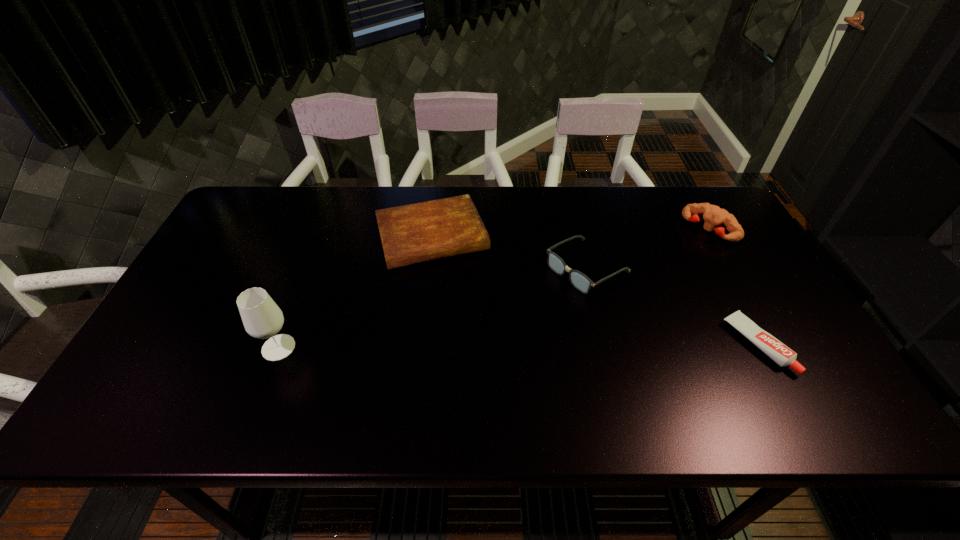
This screenshot has height=540, width=960. Identify the location of the leftmost object. (262, 318).

Locate an element on the screen. The image size is (960, 540). the tallest object is located at coordinates (262, 318).

The width and height of the screenshot is (960, 540). What are the coordinates of `toothpaste` in the screenshot? It's located at (777, 351).

Where is `the second object from left to right`? This screenshot has width=960, height=540. the second object from left to right is located at coordinates (426, 231).

Where is `Bible`? Bible is located at coordinates (426, 231).

The height and width of the screenshot is (540, 960). Identify the location of puncher. (713, 215).

This screenshot has height=540, width=960. I want to click on the third tallest object, so click(580, 281).

Find the location of `the third object from left to right`. the third object from left to right is located at coordinates (580, 281).

Where is `free region located on the right of the glass`? The height and width of the screenshot is (540, 960). free region located on the right of the glass is located at coordinates (392, 347).

Locate an element on the screen. This screenshot has height=540, width=960. vacant space situated on the back of the shortest object is located at coordinates (703, 243).